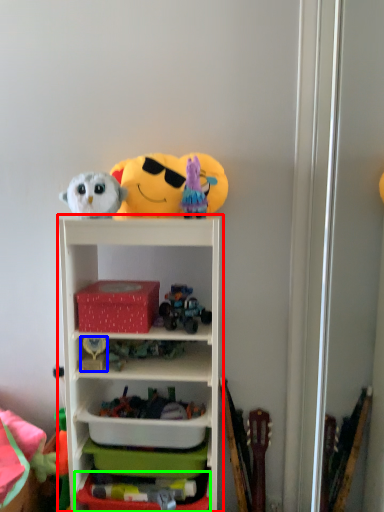
Question: Estimate the real-world distances between objects in this image. Which object is farther from shelf (highlighted by a red box), toy (highlighted by a blue box) or storage box (highlighted by a green box)?

Choices:
 (A) toy
 (B) storage box

Answer: (B)